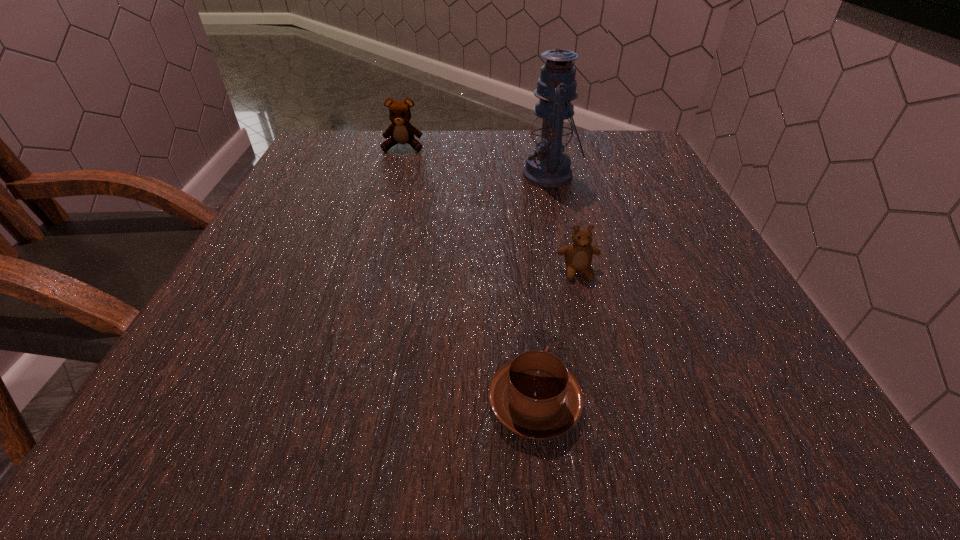
You are a GUI agent. You are given a task and a screenshot of the screen. Output one action in this format:
    pyautogui.click(x=<x>, y=<y>)
    Task: Click on the free point between the second farthest object and the shortest object
    
    Given the screenshot: What is the action you would take?
    pyautogui.click(x=542, y=289)

This screenshot has width=960, height=540. In order to click on vacant area that lies between the leftmost object and the third nearest object in this screenshot , I will do `click(476, 161)`.

You are a GUI agent. You are given a task and a screenshot of the screen. Output one action in this format:
    pyautogui.click(x=<x>, y=<y>)
    Task: Click on the unoccupied area between the shortest object and the second nearest object
    
    Given the screenshot: What is the action you would take?
    pyautogui.click(x=556, y=337)

The width and height of the screenshot is (960, 540). I want to click on blank region between the tallest object and the farthest object, so click(476, 161).

What are the coordinates of `object that is the second nearest to the cappuccino` in the screenshot? It's located at (548, 167).

Where is `the second closest object to the tallest object`? The height and width of the screenshot is (540, 960). the second closest object to the tallest object is located at coordinates (401, 131).